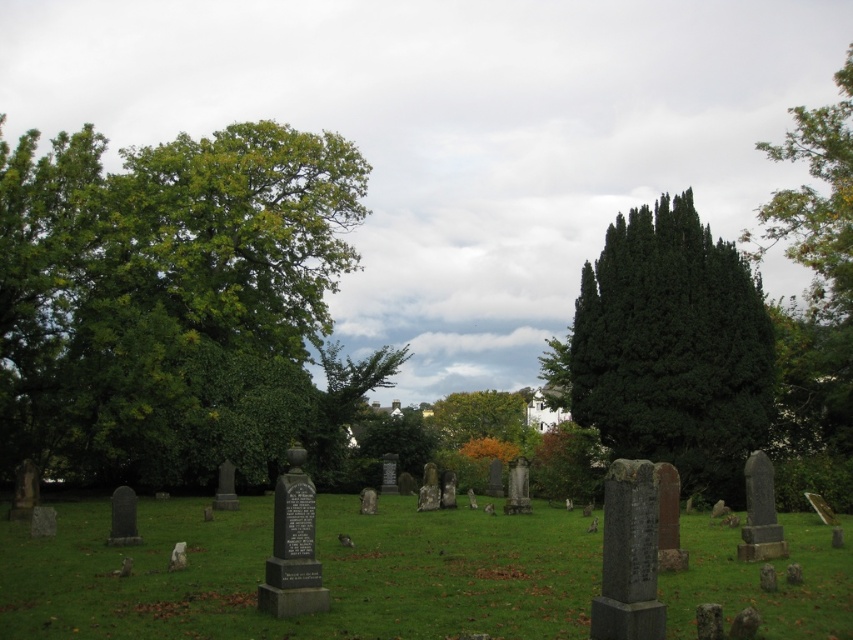
Between point (350, 410) and point (440, 426), which one is positioned in front?

Point (350, 410)

Between green leafy tree at left and green leafy tree at center, which one is positioned lower?

green leafy tree at center is lower down.

Who is more forward, (323, 264) or (518, 428)?

Point (323, 264) is more forward.

Where is `green leafy tree at left`? green leafy tree at left is located at coordinates (177, 305).

Between dark green coniferous tree at center-right and green leafy tree at center, which one has more height?

dark green coniferous tree at center-right

Between point (614, 316) and point (503, 396), which one is positioned behind?

Positioned behind is point (503, 396).

Between point (669, 252) and point (485, 435), which one is positioned in front?

Positioned in front is point (669, 252).

You are a GUI agent. You are given a task and a screenshot of the screen. Output one action in this format:
    pyautogui.click(x=<x>, y=<y>)
    Task: Click on the dark green coniferous tree at center-right
    
    Given the screenshot: What is the action you would take?
    pyautogui.click(x=672, y=348)

Which is above, green leafy tree at left or gray stone gravestones at center?

green leafy tree at left is higher up.

Can you confirm if green leafy tree at left is positioned to the right of gray stone gravestones at center?

In fact, green leafy tree at left is to the left of gray stone gravestones at center.

Where is `green leafy tree at left`? Image resolution: width=853 pixels, height=640 pixels. green leafy tree at left is located at coordinates (177, 305).

Where is `green leafy tree at left`? The height and width of the screenshot is (640, 853). green leafy tree at left is located at coordinates (177, 305).